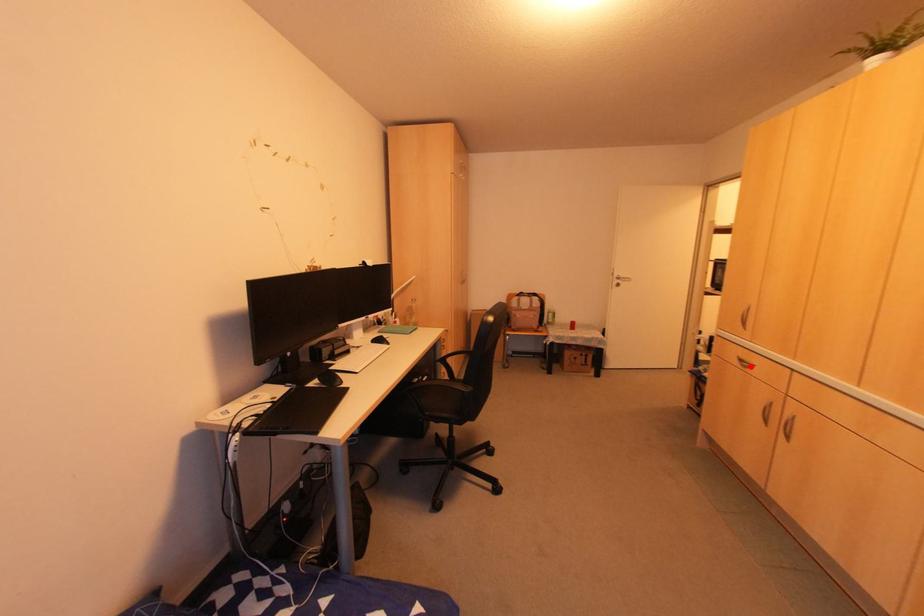
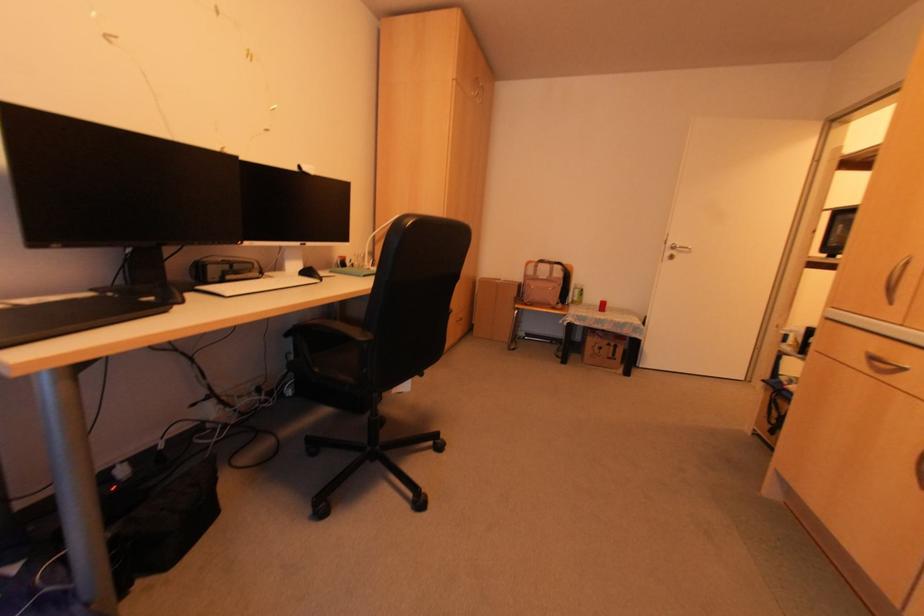
Question: I am providing you with two images of the same scene from different viewpoints. A red point is marked on the first image. Is the red point's position out of view in image 2?

Choices:
 (A) Yes
 (B) No

Answer: (B)